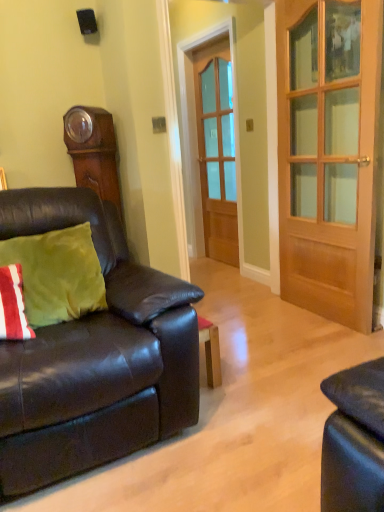
Question: In terms of size, does black matte speaker at upper center appear bigger or smaller than matte black couch at left?

Choices:
 (A) small
 (B) big

Answer: (A)

Question: In terms of height, does black matte speaker at upper center look taller or shorter compared to matte black couch at left?

Choices:
 (A) short
 (B) tall

Answer: (A)

Question: Which object is the farthest from the wooden door at center, the 1th door viewed from the right?

Choices:
 (A) matte black couch at left
 (B) wooden grandfather clock at upper left
 (C) wooden door at center, placed as the 1th door when sorted from back to front
 (D) black matte speaker at upper center
 (E) green velvet pillow at left

Answer: (D)

Question: Estimate the real-world distances between objects in this image. Which object is closer to the green velvet pillow at left?

Choices:
 (A) black matte speaker at upper center
 (B) wooden grandfather clock at upper left
 (C) wooden door at center, which is counted as the 2th door, starting from the right
 (D) wooden door at center, the 1th door viewed from the right
 (E) matte black couch at left

Answer: (E)